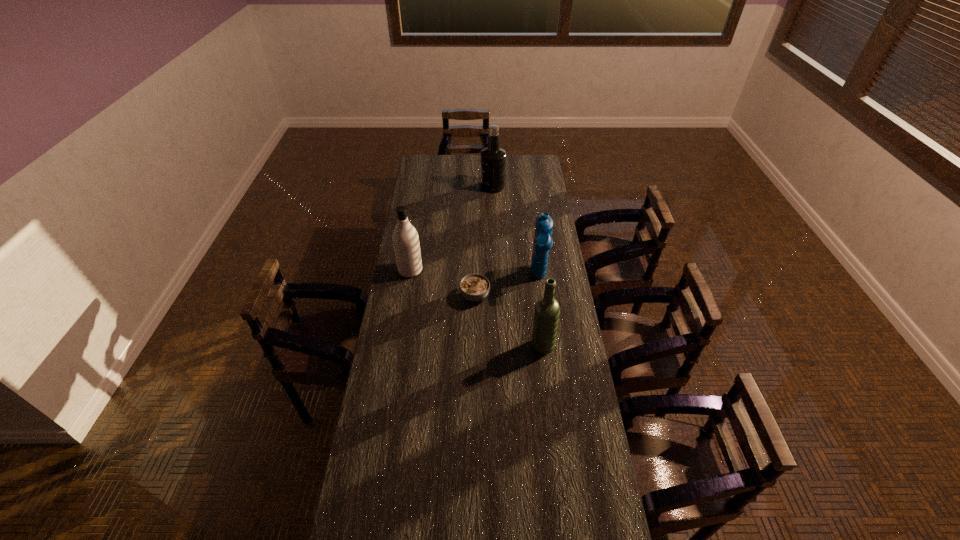
Where is `free space located 0.290m on the left of the right shampoo`? This screenshot has height=540, width=960. free space located 0.290m on the left of the right shampoo is located at coordinates coord(467,278).

Find the location of a particular element. This screenshot has height=540, width=960. free location located 0.210m on the right of the soup bowl is located at coordinates (539, 296).

Image resolution: width=960 pixels, height=540 pixels. I want to click on object that is at the left edge, so coord(405,238).

Where is `wine bottle that is at the right edge`? The height and width of the screenshot is (540, 960). wine bottle that is at the right edge is located at coordinates (546, 316).

Locate an element on the screen. The height and width of the screenshot is (540, 960). shampoo that is at the right edge is located at coordinates (542, 243).

Locate an element on the screen. This screenshot has width=960, height=540. vacant space at the left edge of the desktop is located at coordinates (397, 386).

You are a GUI agent. You are given a task and a screenshot of the screen. Output one action in this format:
    pyautogui.click(x=<x>, y=<y>)
    Task: Click on the free location at the right edge
    This screenshot has width=960, height=540.
    Given the screenshot: What is the action you would take?
    pyautogui.click(x=584, y=449)

The image size is (960, 540). Identify the location of free location at the far right corner. (539, 167).

This screenshot has width=960, height=540. Identify the location of vacant area that lies between the right shampoo and the soup bowl. (507, 287).

Where is `unoccupied position between the liquor and the left shampoo`? unoccupied position between the liquor and the left shampoo is located at coordinates coord(451,228).